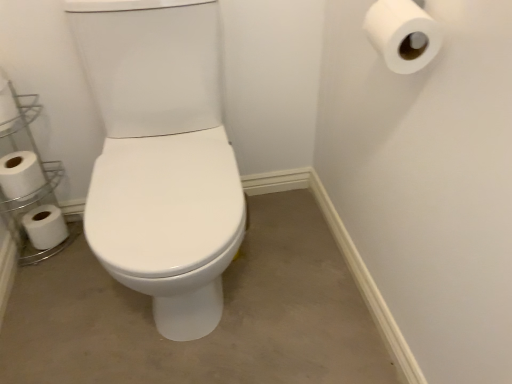
Question: From the image's perspective, is white matte toilet paper at left, which ranks as the second toilet paper in front-to-back order, above or below white glossy toilet at center?

Choices:
 (A) above
 (B) below

Answer: (A)

Question: Is point (7, 127) closer or farther from the camera than point (146, 367)?

Choices:
 (A) closer
 (B) farther

Answer: (B)

Question: Estimate the real-world distances between objects in this image. Which object is farther from the white plastic shelf at left?

Choices:
 (A) white glossy toilet at center
 (B) white matte toilet paper at lower left, marked as the 1th toilet paper in a left-to-right arrangement
 (C) white matte toilet paper at left, which ranks as the second toilet paper in front-to-back order
 (D) white matte toilet paper at lower left, which ranks as the 2th toilet paper in left-to-right order
 (E) white matte toilet paper at upper right, which ranks as the fourth toilet paper in bottom-to-top order

Answer: (E)

Question: Considering the real-world distances, which object is closest to the white matte toilet paper at left, which is the 2th toilet paper from top to bottom?

Choices:
 (A) white matte toilet paper at lower left, which ranks as the third toilet paper in top-to-bottom order
 (B) white plastic shelf at left
 (C) white matte toilet paper at lower left, marked as the 1th toilet paper in a left-to-right arrangement
 (D) white matte toilet paper at upper right, which ranks as the fourth toilet paper in bottom-to-top order
 (E) white glossy toilet at center

Answer: (A)